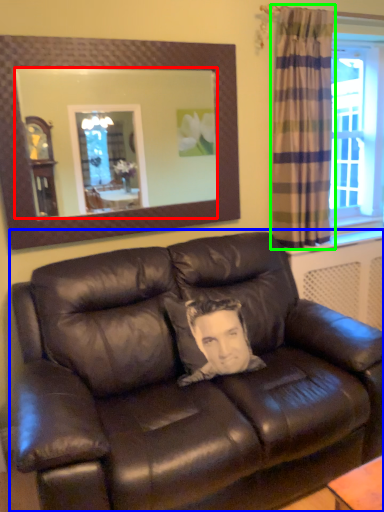
Question: Considering the real-world distances, which object is farthest from mirror (highlighted by a red box)? studio couch (highlighted by a blue box) or curtain (highlighted by a green box)?

Choices:
 (A) studio couch
 (B) curtain

Answer: (A)